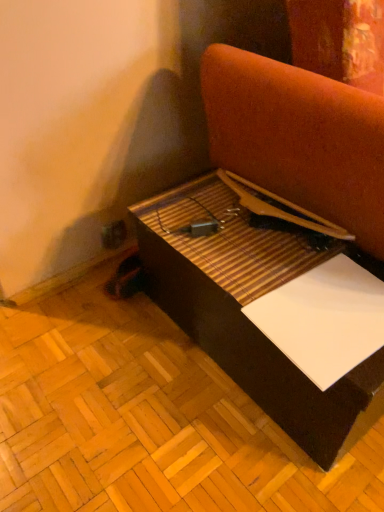
At what (x,y) coordinates should I click in order to perform the action: click on black wood table at lower right. Please return your answer as a coordinate pair (x, y). This screenshot has height=512, width=384. Looking at the image, I should click on (271, 306).

What is the approximate width of black wood table at lower right?

29.90 inches.

What do you see at coordinates (271, 306) in the screenshot? I see `black wood table at lower right` at bounding box center [271, 306].

Measure the distance between black wood table at lower right and camera.

black wood table at lower right and camera are 28.86 inches apart.

Identify the location of black wood table at lower right. (271, 306).